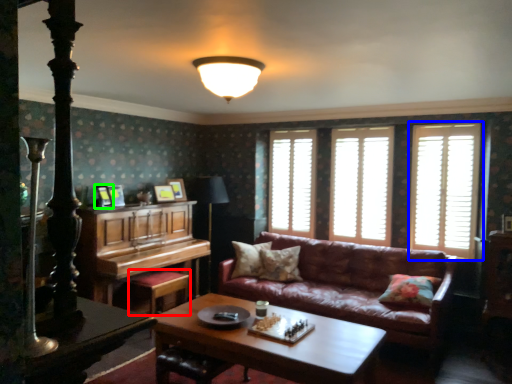
Question: Which object is the closest to the footrest (highlighted by a red box)? Choose among these: window (highlighted by a blue box) or picture frame (highlighted by a green box).

Choices:
 (A) window
 (B) picture frame

Answer: (B)